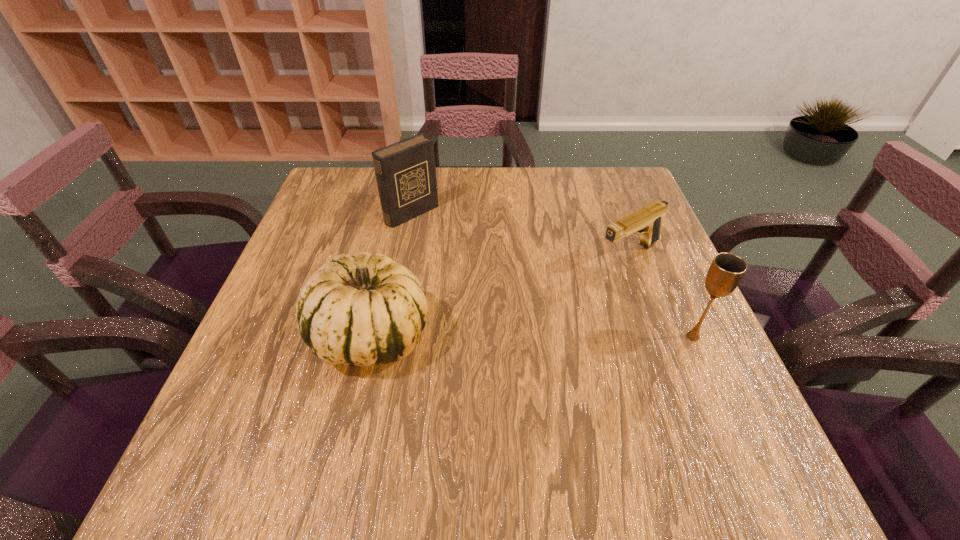
Find the location of `gourd`. gourd is located at coordinates point(366,310).

Image resolution: width=960 pixels, height=540 pixels. In order to click on chalice in this screenshot , I will do `click(726, 271)`.

Locate an element on the screen. The height and width of the screenshot is (540, 960). diary is located at coordinates (405, 171).

Where is `the third nearest object`? The height and width of the screenshot is (540, 960). the third nearest object is located at coordinates (647, 222).

This screenshot has width=960, height=540. I want to click on the shortest object, so click(x=647, y=222).

I want to click on free space located 0.160m on the back of the gourd, so click(x=392, y=247).

Locate an element on the screen. This screenshot has height=540, width=960. vacant space located 0.120m on the left of the chalice is located at coordinates (618, 336).

The image size is (960, 540). Identify the location of vacant space located on the front cover of the diary. (515, 291).

Where is `vacant space located 0.250m on the front cover of the diary`? vacant space located 0.250m on the front cover of the diary is located at coordinates (493, 274).

The image size is (960, 540). What are the coordinates of `blank area located 0.090m on the front cover of the diary` in the screenshot? It's located at (449, 241).